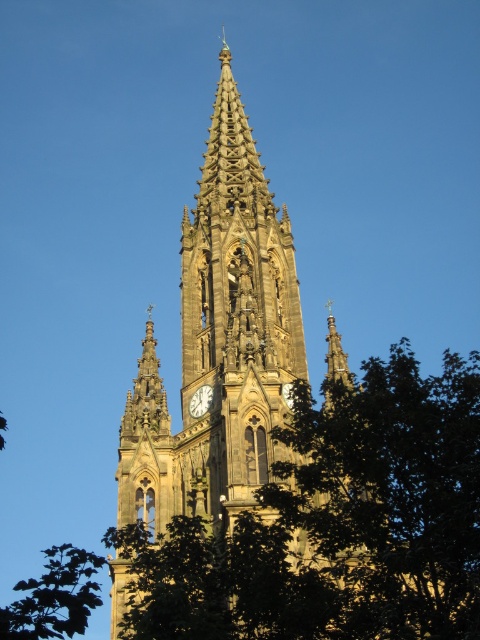
Measure the distance between green leafy tree at center and brown stone tower at center.

They are 11.11 meters apart.

Who is higher up, green leafy tree at center or brown stone tower at center?

brown stone tower at center

Which is in front, point (351, 384) or point (222, 236)?

Point (351, 384) is in front.

The height and width of the screenshot is (640, 480). I want to click on green leafy tree at center, so click(x=336, y=522).

Is the position of brown stone tower at center less distant than that of white glossy clock at center?

That is True.

Who is more distant from viewer, (217, 390) or (206, 410)?

Point (206, 410)

The image size is (480, 640). What are the coordinates of `brown stone tower at center` in the screenshot? It's located at point(218,346).

Who is lower down, green leafy tree at lower left or white glossy clock at center?

green leafy tree at lower left is below.

Based on the photo, who is more distant from viewer, (69, 548) or (212, 390)?

Positioned behind is point (69, 548).

Does point (39, 580) come closer to viewer compared to point (211, 392)?

No.

Identify the location of green leafy tree at lower left. (55, 596).